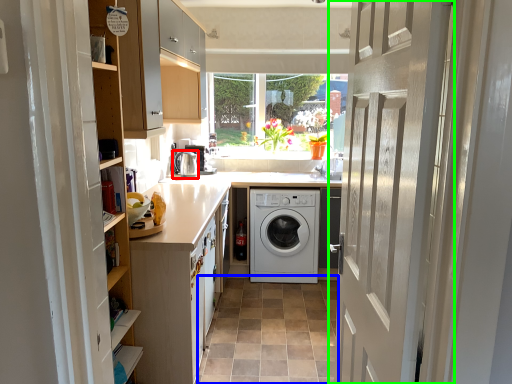
Question: Which object is positioned farthest from water heater (highlighted by a red box)? Select from plain (highlighted by a blue box) and door (highlighted by a green box).

Choices:
 (A) plain
 (B) door

Answer: (B)